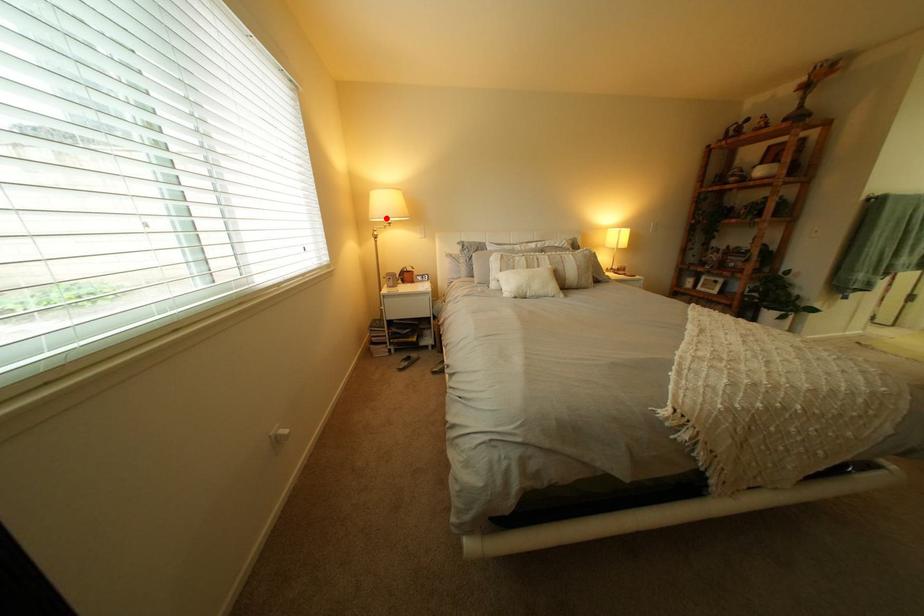
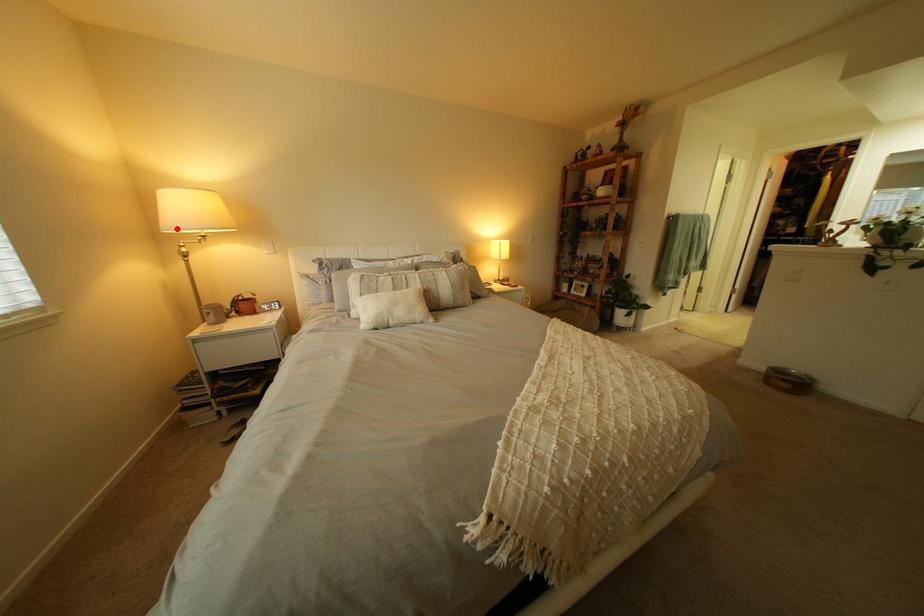
I am providing you with two images of the same scene from different viewpoints. A red point is marked on the first image and another point is marked on the second image. Is the red point in image1 aligned with the point shown in image2?

Yes